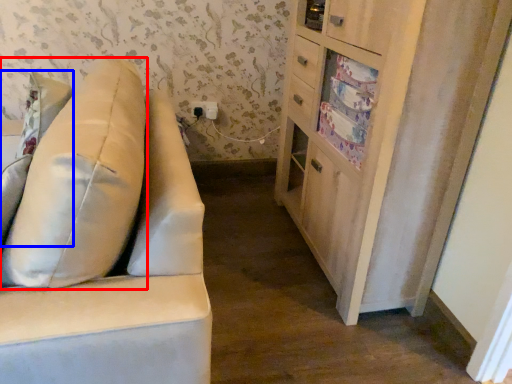
Question: Among these objects, which one is farthest to the camera, throw pillow (highlighted by a red box) or pillow (highlighted by a blue box)?

Choices:
 (A) throw pillow
 (B) pillow

Answer: (B)